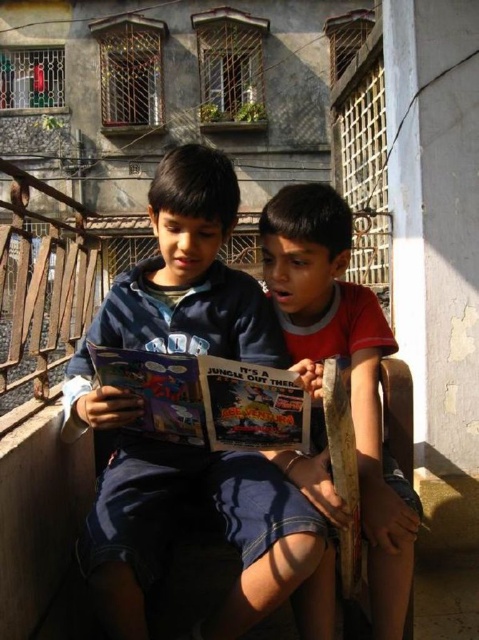
You are a tailor who needs to determine if the matte red shirt at center can be folded and stored in the matte plastic comic book at center. Based on their sizes, can the shirt fit inside the comic book?

The matte red shirt at center is thinner than the matte plastic comic book at center, so it can potentially be folded to fit inside the comic book.

You are a photographer trying to capture a candid shot of the two boys reading the comic book. You want to ensure the blue cotton shirt at center and the matte plastic comic book at center are both visible in the frame. Based on their positions, which object should you focus on first to ensure both are in the shot?

Since the blue cotton shirt at center is to the left of the matte plastic comic book at center, you should focus on the matte plastic comic book at center first to ensure both are in the frame.

You are standing on the balcony and want to place a small plant pot between the two points, point [207,625] and point [324,192]. Which point should the pot be closer to so it is in front of the other point?

The pot should be closer to point [207,625] because it is in front of point [324,192].